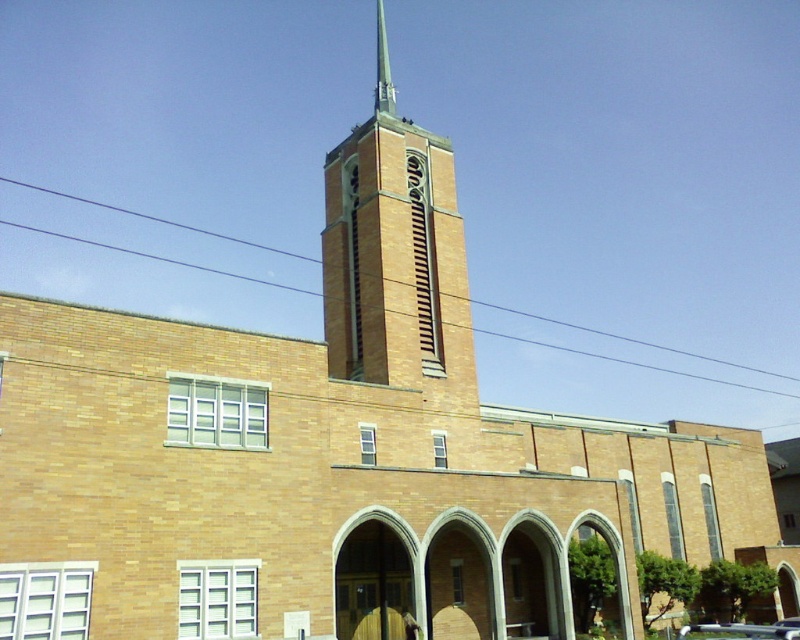
Question: Which is nearer to the metallic silver car at lower right?

Choices:
 (A) brown brick tower at center
 (B) green metallic spire at center top

Answer: (A)

Question: Is brown brick tower at center thinner than metallic silver car at lower right?

Choices:
 (A) no
 (B) yes

Answer: (A)

Question: Does brown brick tower at center have a smaller size compared to green metallic spire at center top?

Choices:
 (A) no
 (B) yes

Answer: (A)

Question: Is metallic silver car at lower right above green metallic spire at center top?

Choices:
 (A) yes
 (B) no

Answer: (B)

Question: Which of the following is the farthest from the observer?

Choices:
 (A) brown brick tower at center
 (B) metallic silver car at lower right
 (C) green metallic spire at center top

Answer: (C)

Question: Among these objects, which one is farthest from the camera?

Choices:
 (A) green metallic spire at center top
 (B) brown brick tower at center

Answer: (A)